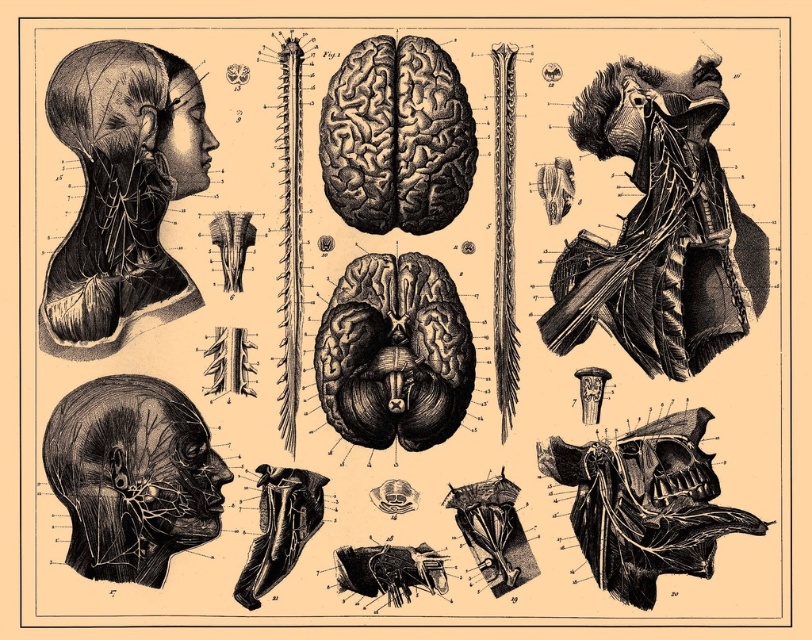
Between black line drawing of head at lower left and black textured neck at lower left, which one is positioned higher?

black textured neck at lower left

Between point (153, 472) and point (121, 168), which one is positioned in front?

Point (153, 472)

Identify the location of black line drawing of head at lower left. (132, 476).

Who is higher up, black textured neck at lower left or smooth black muscle at upper right?

smooth black muscle at upper right is higher up.

Who is positioned more to the left, black textured neck at lower left or smooth black muscle at upper right?

black textured neck at lower left is more to the left.

You are a GUI agent. You are given a task and a screenshot of the screen. Output one action in this format:
    pyautogui.click(x=<x>, y=<y>)
    Task: Click on the black textured neck at lower left
    This screenshot has width=812, height=640.
    Given the screenshot: What is the action you would take?
    click(x=117, y=227)

Identify the location of black textured neck at lower left. This screenshot has width=812, height=640. (117, 227).

Who is lower down, black line drawing of head at lower left or matte black head at upper left?

black line drawing of head at lower left is lower down.

You are a GUI agent. You are given a task and a screenshot of the screen. Output one action in this format:
    pyautogui.click(x=<x>, y=<y>)
    Task: Click on the black line drawing of head at lower left
    
    Given the screenshot: What is the action you would take?
    pyautogui.click(x=132, y=476)

Who is more distant from viewer, [152,433] or [191,115]?

Positioned behind is point [191,115].

Locate an element on the screen. black line drawing of head at lower left is located at coordinates (132, 476).